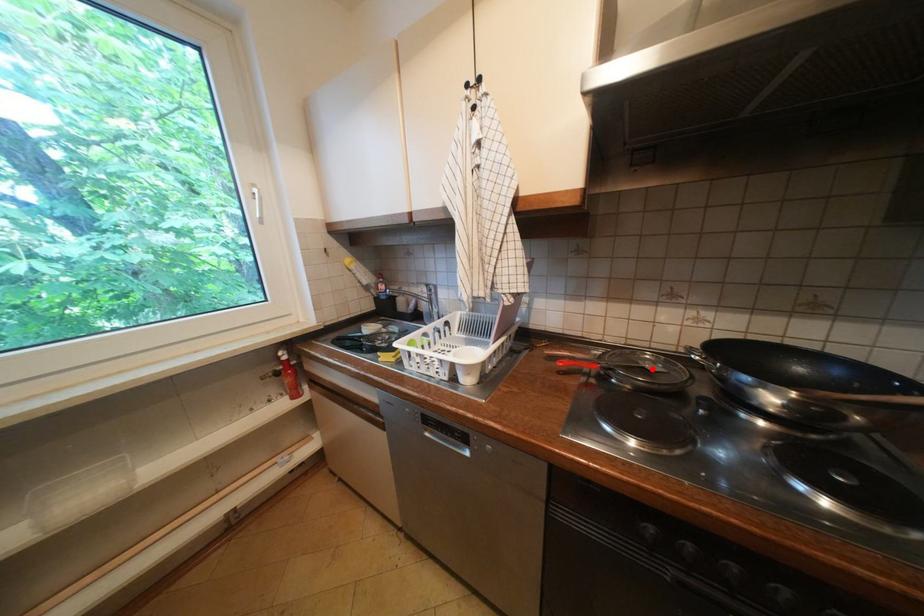
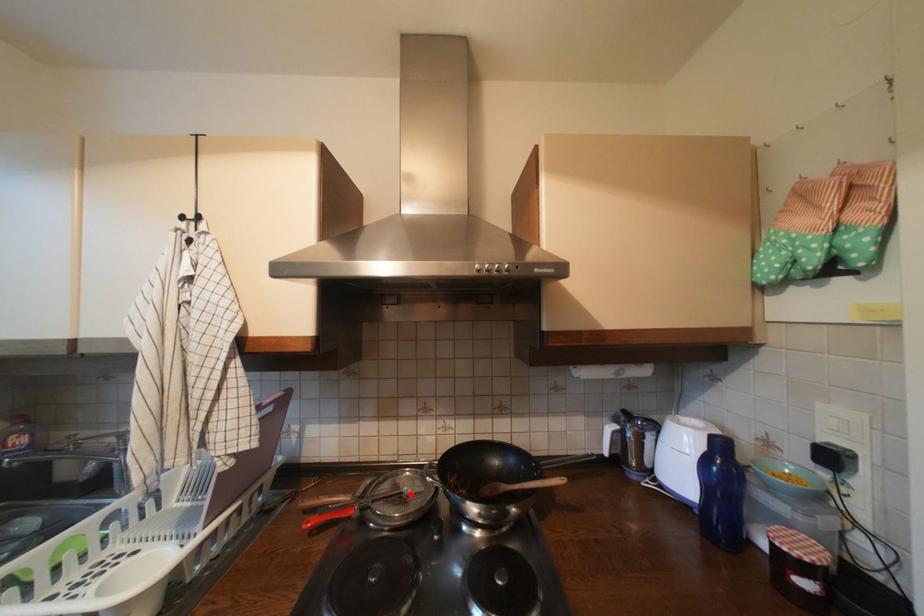
I am providing you with two images of the same scene from different viewpoints. A red point is marked on the first image and another point is marked on the second image. Does the point marked in image1 correspond to the same location as the one in image2?

Yes